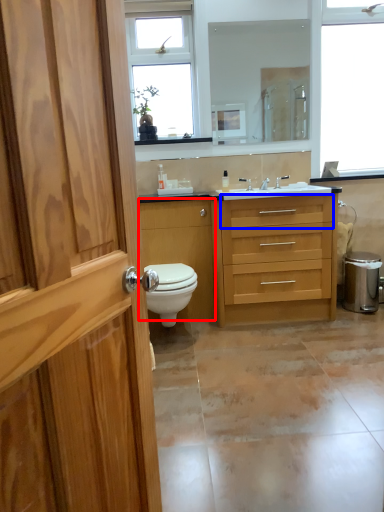
Question: Which object is further to the camera taking this photo, cabinetry (highlighted by a red box) or drawer (highlighted by a blue box)?

Choices:
 (A) cabinetry
 (B) drawer

Answer: (A)